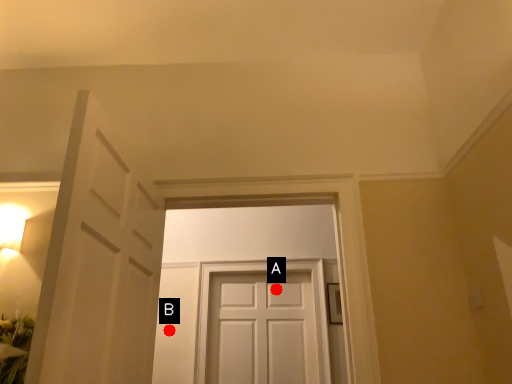
Question: Two points are circled on the image, labeled by A and B beside each circle. Which point is closer to the camera taking this photo?

Choices:
 (A) A is closer
 (B) B is closer

Answer: (B)